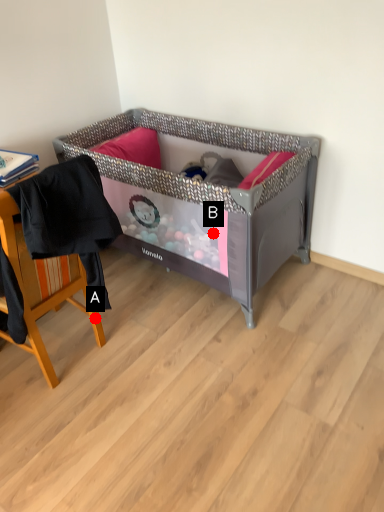
Question: Two points are circled on the image, labeled by A and B beside each circle. Which of the following is the closest to the observer?

Choices:
 (A) A is closer
 (B) B is closer

Answer: (A)